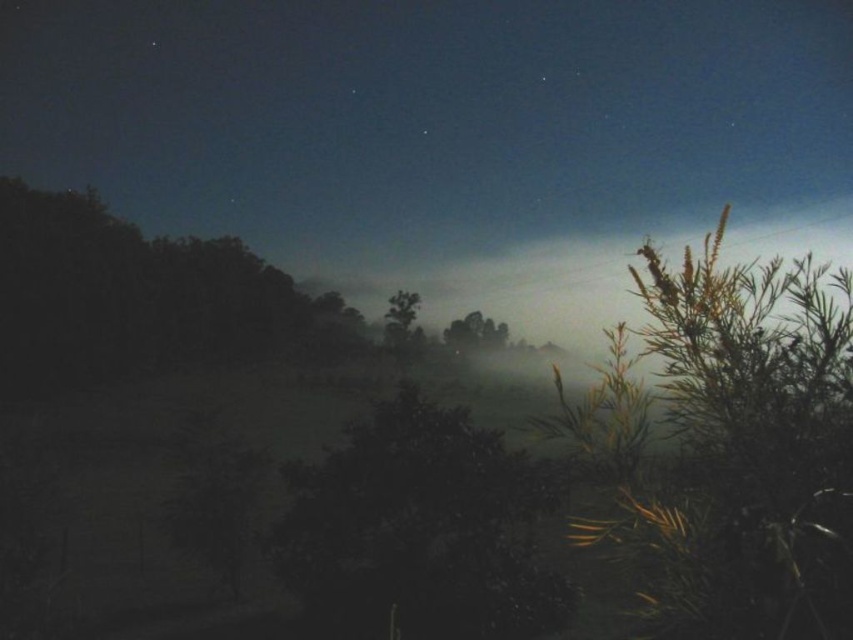
Question: Is green leafy plant at right positioned at the back of green matte tree at center?

Choices:
 (A) yes
 (B) no

Answer: (B)

Question: Which object appears closest to the camera in this image?

Choices:
 (A) green leafy plant at right
 (B) green leafy tree at center

Answer: (A)

Question: Among these points, which one is nearest to the camera?

Choices:
 (A) (515, 566)
 (B) (393, 344)

Answer: (A)

Question: Estimate the real-world distances between objects in this image. Which object is farther from the green leafy tree at center?

Choices:
 (A) translucent foggy tree at center
 (B) green leafy plant at right

Answer: (B)

Question: Observing the image, what is the correct spatial positioning of green leafy plant at right in reference to green leafy tree at center?

Choices:
 (A) right
 (B) left

Answer: (A)

Question: Is translucent foggy tree at center smaller than green leafy tree at center?

Choices:
 (A) no
 (B) yes

Answer: (A)